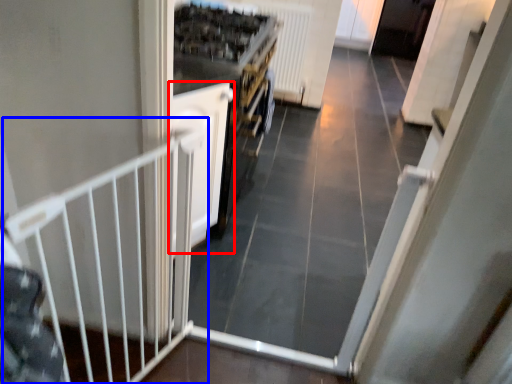
Question: Which of the following is the closest to the observer, door (highlighted by a red box) or rail (highlighted by a blue box)?

Choices:
 (A) door
 (B) rail

Answer: (B)